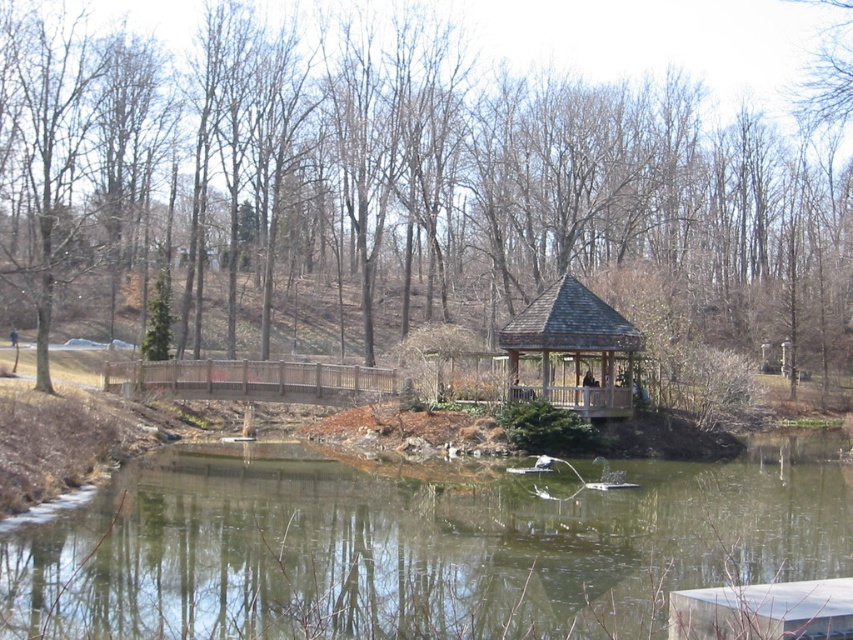
Question: Among these points, which one is farthest from the camera?

Choices:
 (A) (590, 586)
 (B) (361, 269)
 (C) (578, 291)

Answer: (B)

Question: Which is farther from the wooden gazebo at center?

Choices:
 (A) greenish reflective water at center
 (B) green leafy tree at center

Answer: (B)

Question: Can you confirm if green leafy tree at center is wider than wooden gazebo at center?

Choices:
 (A) yes
 (B) no

Answer: (A)

Question: Does green leafy tree at center come behind wooden gazebo at center?

Choices:
 (A) no
 (B) yes

Answer: (A)

Question: Which object is the closest to the wooden gazebo at center?

Choices:
 (A) green leafy tree at center
 (B) greenish reflective water at center

Answer: (B)

Question: Does green leafy tree at center appear on the left side of wooden gazebo at center?

Choices:
 (A) no
 (B) yes

Answer: (B)